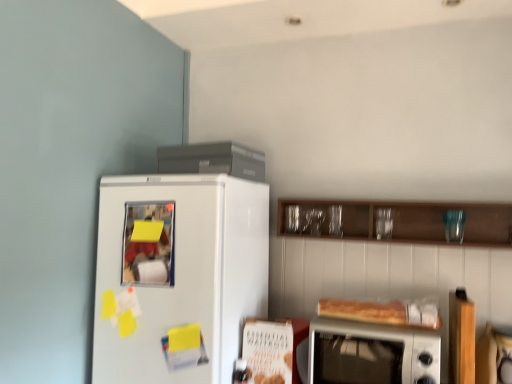
Question: Does satin gray refrigerator at upper center appear on the left side of wooden cabinet at upper center?

Choices:
 (A) no
 (B) yes

Answer: (B)

Question: Is satin gray refrigerator at upper center oriented away from wooden cabinet at upper center?

Choices:
 (A) no
 (B) yes

Answer: (A)

Question: From the image's perspective, does satin gray refrigerator at upper center appear lower than wooden cabinet at upper center?

Choices:
 (A) no
 (B) yes

Answer: (A)

Question: Does satin gray refrigerator at upper center have a greater width compared to wooden cabinet at upper center?

Choices:
 (A) no
 (B) yes

Answer: (A)

Question: Would you consider satin gray refrigerator at upper center to be distant from wooden cabinet at upper center?

Choices:
 (A) yes
 (B) no

Answer: (B)

Question: In terms of height, does satin gray refrigerator at upper center look taller or shorter compared to wooden cabinet at upper center?

Choices:
 (A) short
 (B) tall

Answer: (A)

Question: Is satin gray refrigerator at upper center wider or thinner than wooden cabinet at upper center?

Choices:
 (A) wide
 (B) thin

Answer: (B)

Question: From a real-world perspective, is satin gray refrigerator at upper center physically located above or below wooden cabinet at upper center?

Choices:
 (A) below
 (B) above

Answer: (B)

Question: Is point (225, 152) positioned closer to the camera than point (490, 213)?

Choices:
 (A) farther
 (B) closer

Answer: (B)

Question: Based on their positions, is wooden cabinet at upper center located to the left or right of satin gray refrigerator at upper center?

Choices:
 (A) right
 (B) left

Answer: (A)

Question: Considering the positions of wooden cabinet at upper center and satin gray refrigerator at upper center in the image, is wooden cabinet at upper center taller or shorter than satin gray refrigerator at upper center?

Choices:
 (A) short
 (B) tall

Answer: (B)

Question: Considering the positions of wooden cabinet at upper center and satin gray refrigerator at upper center in the image, is wooden cabinet at upper center bigger or smaller than satin gray refrigerator at upper center?

Choices:
 (A) small
 (B) big

Answer: (B)

Question: Is wooden cabinet at upper center inside or outside of satin gray refrigerator at upper center?

Choices:
 (A) outside
 (B) inside

Answer: (A)

Question: Considering their positions, is silver metallic microwave oven at lower right located in front of or behind satin gray refrigerator at upper center?

Choices:
 (A) front
 (B) behind

Answer: (A)

Question: In terms of size, does silver metallic microwave oven at lower right appear bigger or smaller than satin gray refrigerator at upper center?

Choices:
 (A) small
 (B) big

Answer: (B)